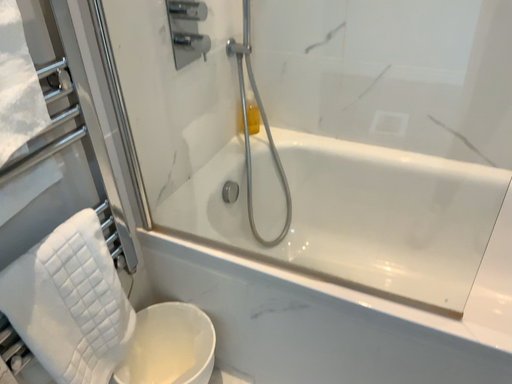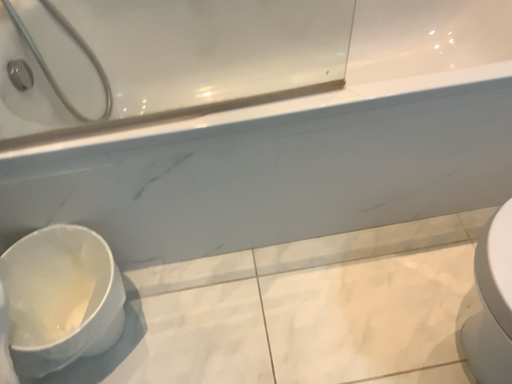
Question: Which way did the camera rotate in the video?

Choices:
 (A) rotated right
 (B) rotated left

Answer: (A)